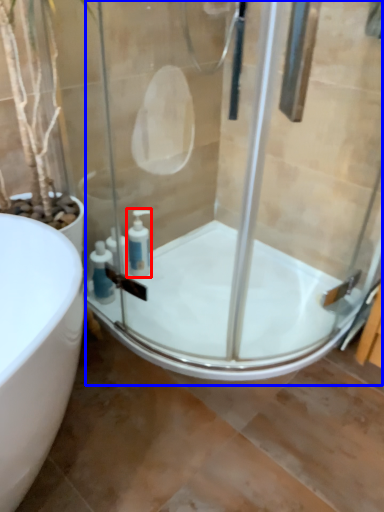
Question: Which object is closer to the camera taking this photo, soap dispenser (highlighted by a red box) or shower door (highlighted by a blue box)?

Choices:
 (A) soap dispenser
 (B) shower door

Answer: (B)